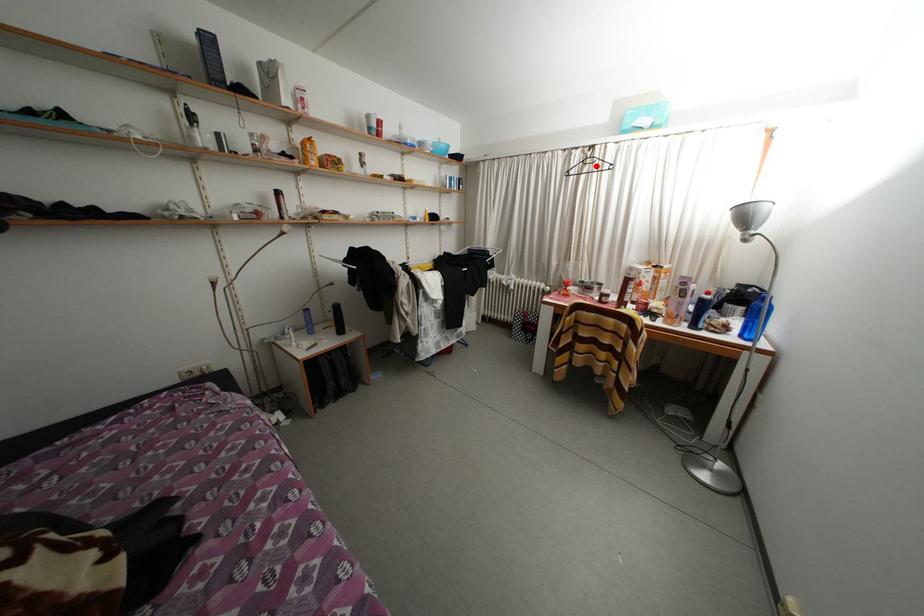
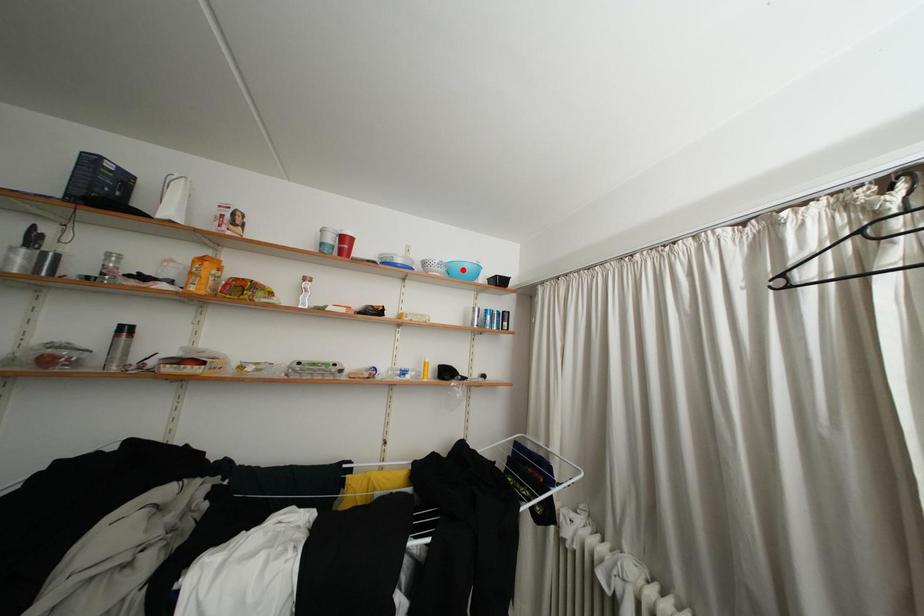
Based on the photo, I am providing you with two images of the same scene from different viewpoints. A red point is marked on the first image and another point is marked on the second image. Is the red point in image1 aligned with the point shown in image2?

No